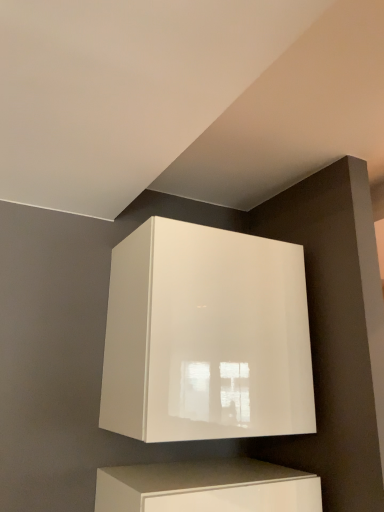
Question: Should I look upward or downward to see glossy white cabinet at upper center?

Choices:
 (A) down
 (B) up

Answer: (A)